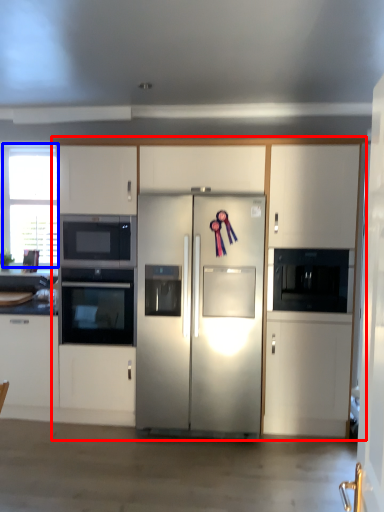
Question: Which point is closer to the camera, cabinetry (highlighted by a red box) or window (highlighted by a blue box)?

Choices:
 (A) cabinetry
 (B) window

Answer: (A)